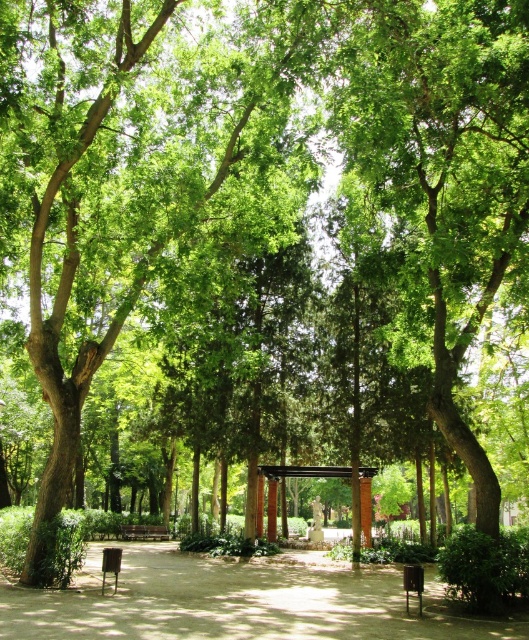
You are standing at the edge of the park and want to walk towards the point marked at coordinates point (x=236, y=602). Based on the scene description, what surface will you be walking on when you reach that point?

The point (x=236, y=602) is on brown dirt path at center, so you will be walking on the brown dirt path at center when you reach that point.

In the scene shown: You are standing at the entrance of the park and want to find the brown wooden pergola at center. According to the coordinates provided, in which direction should you walk to reach it?

The brown wooden pergola at center is located at point (304, 472), which means it is positioned to the right and slightly forward from your current position at the entrance. You should walk towards the right and forward to reach it.

You are standing in the park and want to take a photo of both the statue and the arbor. The statue is located at point (127, 621) and the arbor is at point (269, 536). Which point should you stand closer to ensure both are in focus?

You should stand closer to point (127, 621) because it is closer to the camera, allowing both the statue and the arbor to be in focus simultaneously.